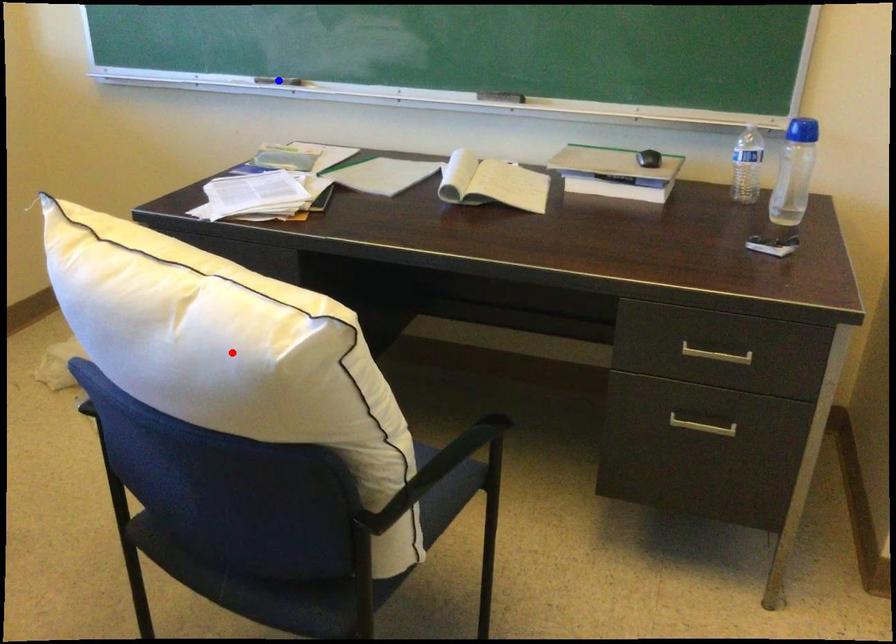
Question: Two points are marked on the image. Which point is closer to the camera?

Choices:
 (A) Blue point is closer.
 (B) Red point is closer.

Answer: (B)